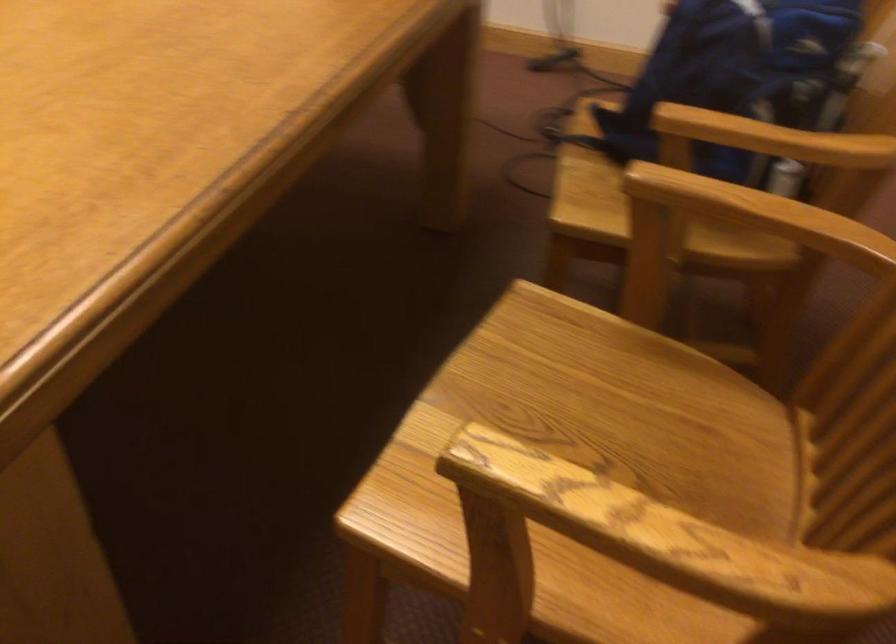
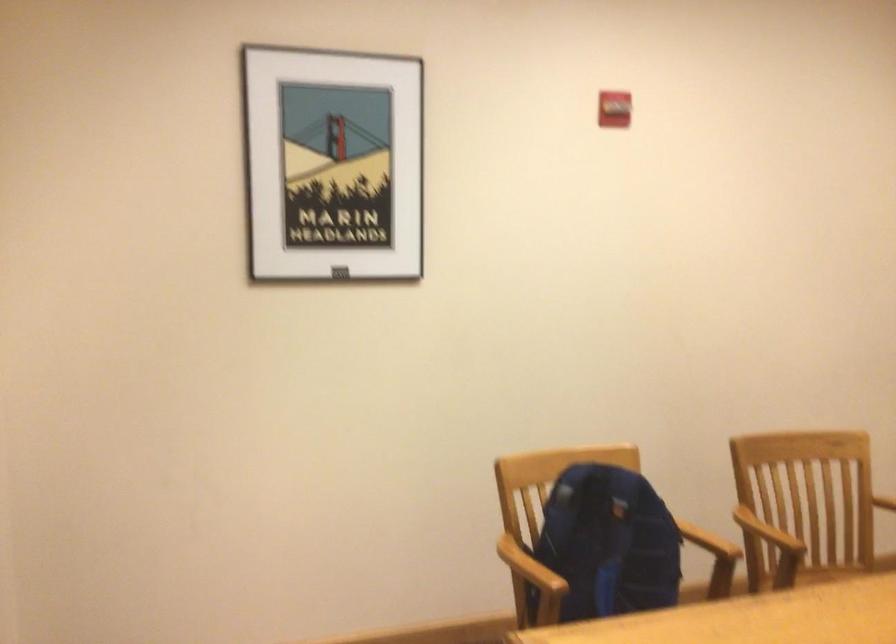
The point at (729, 190) is marked in the first image. Where is the corresponding point in the second image?

(767, 532)